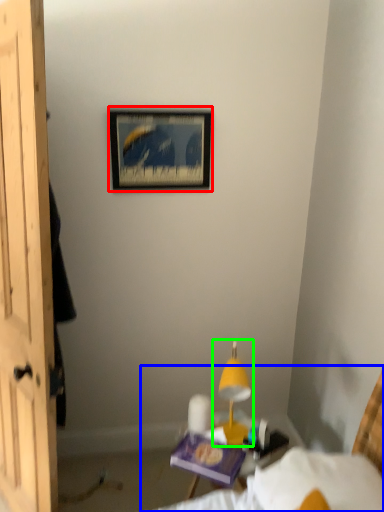
Question: Considering the real-world distances, which object is closest to picture frame (highlighted by a red box)? bed (highlighted by a blue box) or table lamp (highlighted by a green box).

Choices:
 (A) bed
 (B) table lamp

Answer: (B)